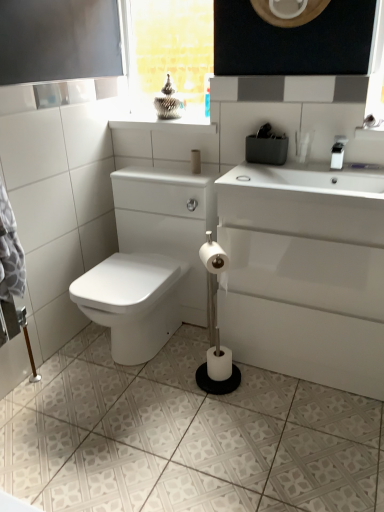
What are the coordinates of `free spot to the right of white matte soap at upper right` in the screenshot? It's located at (275, 178).